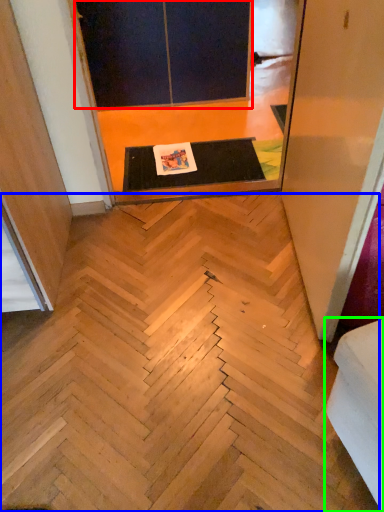
Question: Estimate the real-world distances between objects in this image. Which object is farther from screen door (highlighted by a red box), stairwell (highlighted by a blue box) or furniture (highlighted by a green box)?

Choices:
 (A) stairwell
 (B) furniture

Answer: (B)